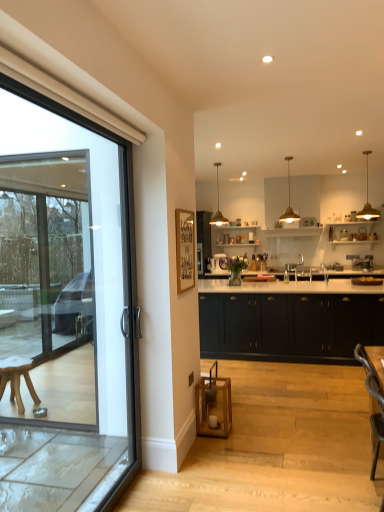
Locate an element on the screen. matte black cabinets at center is located at coordinates pos(289,326).

What do you see at coordinates (289, 326) in the screenshot?
I see `matte black cabinets at center` at bounding box center [289, 326].

The image size is (384, 512). What do you see at coordinates (375, 398) in the screenshot? I see `wooden armchair at lower right` at bounding box center [375, 398].

Image resolution: width=384 pixels, height=512 pixels. Find the location of `wooden armchair at lower right`. wooden armchair at lower right is located at coordinates (375, 398).

Where is `matte black cabinets at center`? matte black cabinets at center is located at coordinates pos(289,326).

Which is more to the left, wooden armchair at lower right or matte black cabinets at center?

From the viewer's perspective, wooden armchair at lower right appears more on the left side.

Considering the positions of objects wooden armchair at lower right and matte black cabinets at center in the image provided, who is in front, wooden armchair at lower right or matte black cabinets at center?

wooden armchair at lower right is in front.

Is point (371, 373) positioned behind point (238, 310)?

No, (371, 373) is closer to viewer.

From the image's perspective, who appears lower, wooden armchair at lower right or matte black cabinets at center?

wooden armchair at lower right.

From a real-world perspective, relative to matte black cabinets at center, is wooden armchair at lower right vertically above or below?

wooden armchair at lower right is situated lower than matte black cabinets at center in the real world.

Looking at their sizes, would you say wooden armchair at lower right is wider or thinner than matte black cabinets at center?

Considering their sizes, wooden armchair at lower right looks slimmer than matte black cabinets at center.

Considering the sizes of objects wooden armchair at lower right and matte black cabinets at center in the image provided, who is taller, wooden armchair at lower right or matte black cabinets at center?

With more height is matte black cabinets at center.

Considering the relative sizes of wooden armchair at lower right and matte black cabinets at center in the image provided, is wooden armchair at lower right smaller than matte black cabinets at center?

Yes.

Can we say wooden armchair at lower right lies outside matte black cabinets at center?

Yes, wooden armchair at lower right is not within matte black cabinets at center.

Is the surface of wooden armchair at lower right in direct contact with matte black cabinets at center?

No, wooden armchair at lower right is not in contact with matte black cabinets at center.

Is wooden armchair at lower right aimed at matte black cabinets at center?

No, wooden armchair at lower right is not facing towards matte black cabinets at center.

This screenshot has width=384, height=512. Find the location of `armchair on the left of matte black cabinets at center`. armchair on the left of matte black cabinets at center is located at coordinates (375, 398).

Consider the image. Does matte black cabinets at center appear on the right side of wooden armchair at lower right?

Indeed, matte black cabinets at center is positioned on the right side of wooden armchair at lower right.

Considering their positions, is matte black cabinets at center located in front of or behind wooden armchair at lower right?

matte black cabinets at center is behind wooden armchair at lower right.

Is point (370, 331) positioned behind point (354, 351)?

Yes, it is behind point (354, 351).

From the image's perspective, is matte black cabinets at center located above wooden armchair at lower right?

Indeed, from the image's perspective, matte black cabinets at center is shown above wooden armchair at lower right.

From a real-world perspective, who is located higher, matte black cabinets at center or wooden armchair at lower right?

matte black cabinets at center is physically above.

Looking at their sizes, would you say matte black cabinets at center is wider or thinner than wooden armchair at lower right?

matte black cabinets at center is wider than wooden armchair at lower right.

From their relative heights in the image, would you say matte black cabinets at center is taller or shorter than wooden armchair at lower right?

Clearly, matte black cabinets at center is taller compared to wooden armchair at lower right.

Considering the sizes of objects matte black cabinets at center and wooden armchair at lower right in the image provided, who is bigger, matte black cabinets at center or wooden armchair at lower right?

Bigger between the two is matte black cabinets at center.

Is matte black cabinets at center outside of wooden armchair at lower right?

Yes.

Is there a large distance between matte black cabinets at center and wooden armchair at lower right?

matte black cabinets at center is far away from wooden armchair at lower right.

Is matte black cabinets at center oriented towards wooden armchair at lower right?

Yes, matte black cabinets at center faces towards wooden armchair at lower right.

What's the angular difference between matte black cabinets at center and wooden armchair at lower right's facing directions?

They differ by 87.7 degrees in their facing directions.

The height and width of the screenshot is (512, 384). Identify the location of armchair in front of the matte black cabinets at center. (375, 398).

This screenshot has height=512, width=384. Find the location of `armchair that is under the matte black cabinets at center (from a real-world perspective)`. armchair that is under the matte black cabinets at center (from a real-world perspective) is located at coordinates (375, 398).

I want to click on armchair that is in front of the matte black cabinets at center, so click(375, 398).